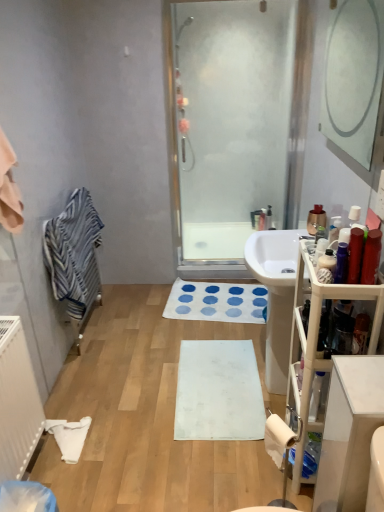
Question: From the image's perspective, is blue striped towel at left above or below white glossy sink at center?

Choices:
 (A) above
 (B) below

Answer: (A)

Question: Is blue striped towel at left in front of or behind white glossy sink at center in the image?

Choices:
 (A) front
 (B) behind

Answer: (B)

Question: Which of these objects is positioned farthest from the blue striped towel at left?

Choices:
 (A) white fabric bath mat at center, which appears as the second bath mat when viewed from the front
 (B) transparent glass shower door at center
 (C) matte silver faucet at center
 (D) matte red tube at right, the 1th toiletry viewed from the front
 (E) white matte bath mat at center, which is the 1th bath mat in front-to-back order

Answer: (D)

Question: Considering the real-world distances, which object is farthest from the matte silver faucet at center?

Choices:
 (A) white matte bath mat at center, which is the 1th bath mat in front-to-back order
 (B) white glossy sink at center
 (C) blue striped towel at left
 (D) matte red tube at right, marked as the 2th toiletry in a right-to-left arrangement
 (E) white fabric bath mat at center, acting as the 1th bath mat starting from the top

Answer: (C)